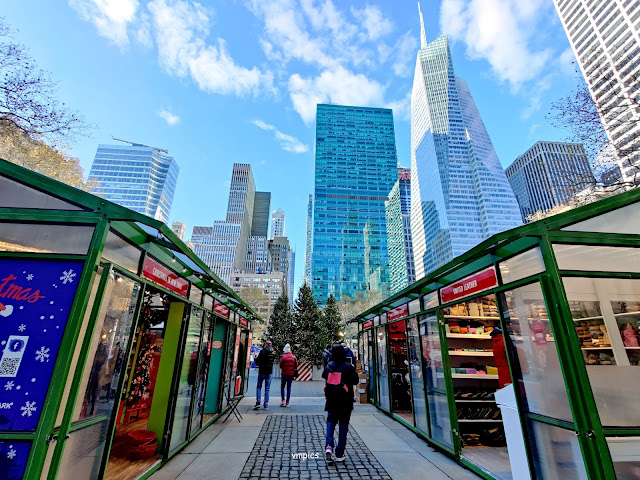
Locate an element on the screen. The image size is (640, 480). chairs is located at coordinates (232, 404).